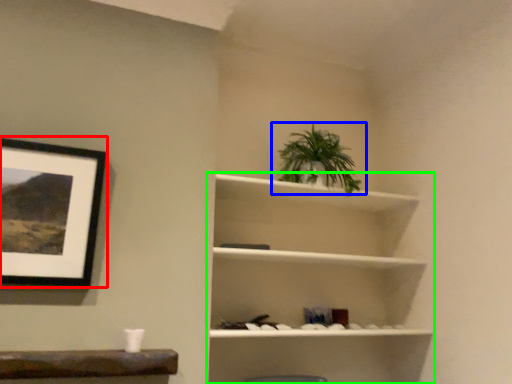
Question: Considering the real-world distances, which object is farthest from picture frame (highlighted by a red box)? houseplant (highlighted by a blue box) or shelf (highlighted by a green box)?

Choices:
 (A) houseplant
 (B) shelf

Answer: (A)